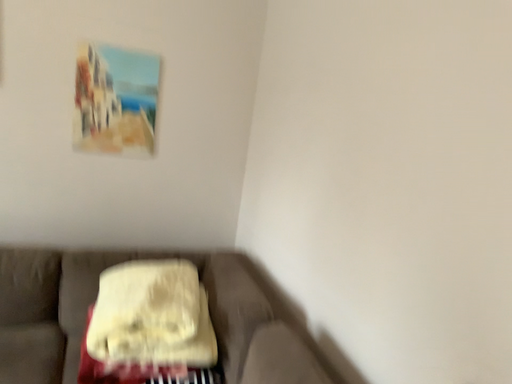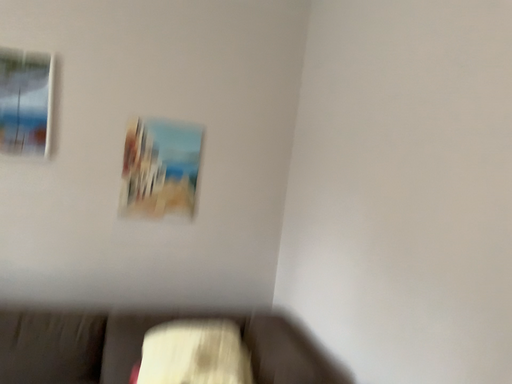
Question: Which way did the camera rotate in the video?

Choices:
 (A) rotated downward
 (B) rotated upward

Answer: (B)